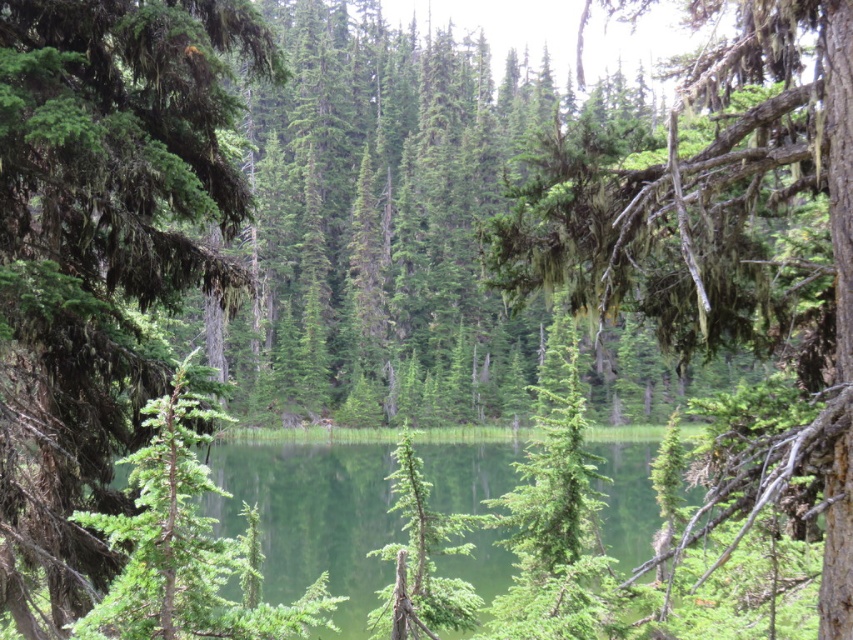
You are standing in the forest and want to reach a specific location marked by point coordinates at point [244,273]. If you walk straight ahead, how far will you have to go to reach that point?

The distance between you and point [244,273] is 11.47 meters, so you will have to walk 11.47 meters straight ahead to reach it.